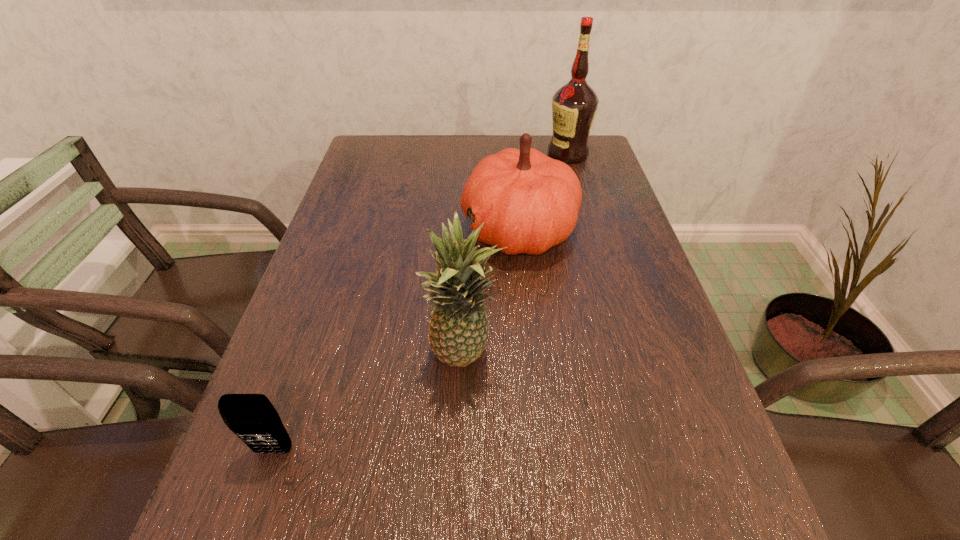
Identify the location of object at the far right corner. (574, 105).

In the image, there is a desktop. What are the coordinates of `vacant space at the far edge` in the screenshot? It's located at (476, 167).

Where is `vacant region at the left edge`? This screenshot has height=540, width=960. vacant region at the left edge is located at coordinates (388, 191).

The height and width of the screenshot is (540, 960). I want to click on vacant space at the right edge of the desktop, so click(x=624, y=285).

Where is `vacant region at the far left corner of the desktop`? The width and height of the screenshot is (960, 540). vacant region at the far left corner of the desktop is located at coordinates (368, 151).

This screenshot has height=540, width=960. In order to click on vacant area that lies between the shortest object and the tallest object in this screenshot , I will do `click(420, 302)`.

You are a GUI agent. You are given a task and a screenshot of the screen. Output one action in this format:
    pyautogui.click(x=<x>, y=<y>)
    Task: Click on the free spot between the pineapple and the tallest object
    
    Given the screenshot: What is the action you would take?
    pyautogui.click(x=516, y=256)

Where is `free space between the second tallest object and the pumpkin`? This screenshot has width=960, height=540. free space between the second tallest object and the pumpkin is located at coordinates (492, 293).

Where is `unoccupied position between the pineapple and the shortest object`? This screenshot has width=960, height=540. unoccupied position between the pineapple and the shortest object is located at coordinates (370, 404).

Identify the location of free area in between the leftmost object and the pineapple. The width and height of the screenshot is (960, 540). (370, 404).